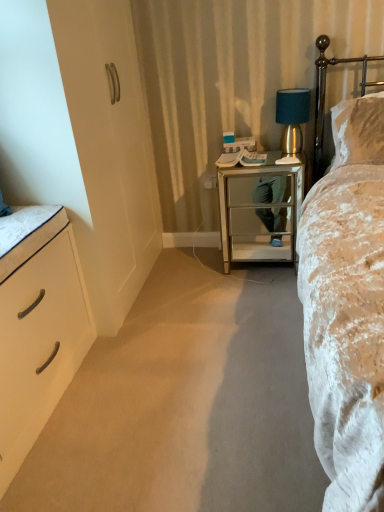
Where is `free location above silver mirrored nightstand at center (from a real-world perspective)`? This screenshot has width=384, height=512. free location above silver mirrored nightstand at center (from a real-world perspective) is located at coordinates (262, 154).